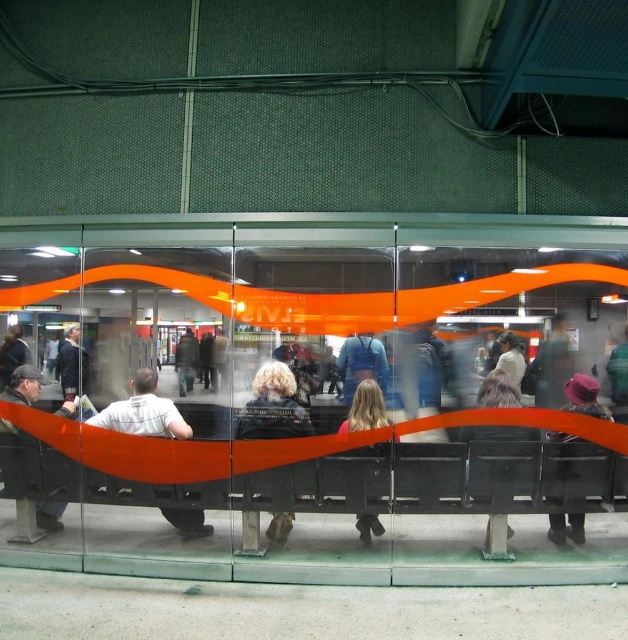
Question: Does dark brown leather jacket at lower right have a greater width compared to dark brown leather jacket at center?

Choices:
 (A) yes
 (B) no

Answer: (A)

Question: Is dark brown leather jacket at lower right positioned at the back of matte black jacket at left?

Choices:
 (A) no
 (B) yes

Answer: (A)

Question: Which of the following is the closest to the observer?

Choices:
 (A) dark brown leather jacket at lower right
 (B) matte black jacket at center
 (C) velvet purple hat at center

Answer: (B)

Question: Is blonde hair at center positioned in front of dark blue jacket at center?

Choices:
 (A) yes
 (B) no

Answer: (A)

Question: Which point is farther from the camera taking this photo?

Choices:
 (A) (475, 436)
 (B) (379, 396)
 (C) (72, 364)

Answer: (C)

Question: Which object is positioned farthest from the velvet purple hat at center?

Choices:
 (A) blonde hair at center
 (B) matte black jacket at left

Answer: (B)